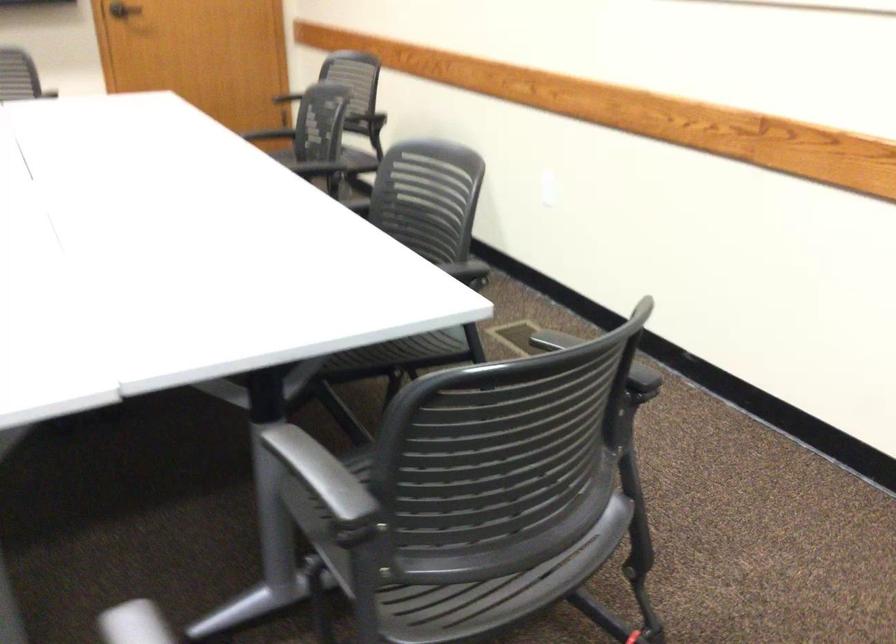
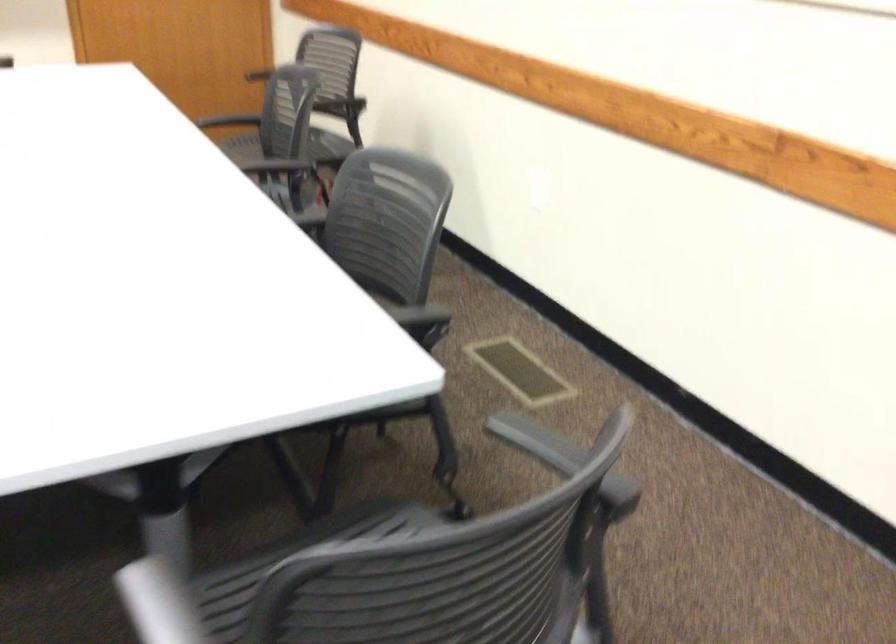
Locate, in the second image, the point that corresponds to [458,269] in the first image.

(419, 315)